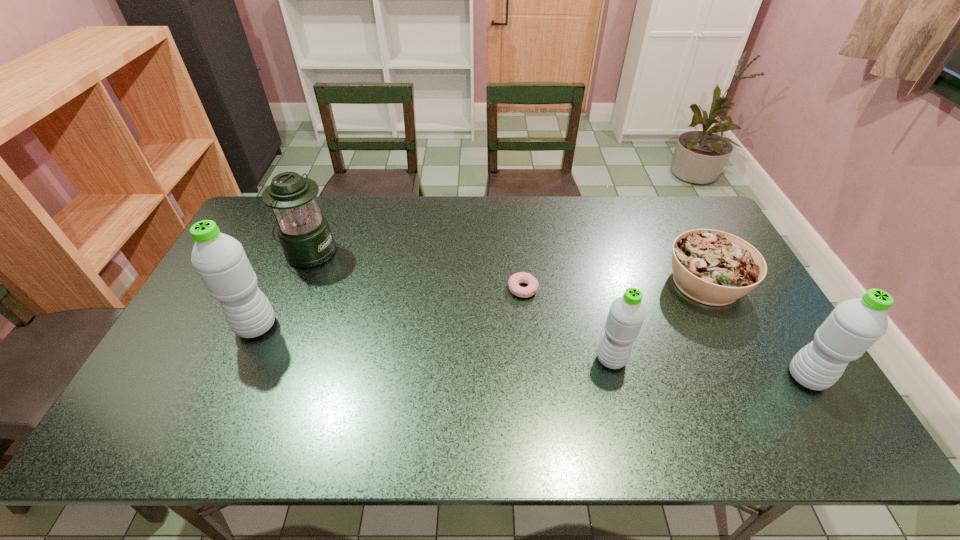
This screenshot has height=540, width=960. I want to click on the leftmost water bottle, so click(x=220, y=260).

You are a GUI agent. You are given a task and a screenshot of the screen. Output one action in this format:
    pyautogui.click(x=<x>, y=<y>)
    Task: Click on the fourth object from left to right
    
    Given the screenshot: What is the action you would take?
    pyautogui.click(x=627, y=313)

Identify the location of the shortest water bottle. Image resolution: width=960 pixels, height=540 pixels. (627, 313).

Where is `the second shortest water bottle`? This screenshot has height=540, width=960. the second shortest water bottle is located at coordinates (854, 325).

At what (x,y) coordinates should I click in order to perform the action: click on lantern. Please return your answer as a coordinate pair (x, y). Looking at the image, I should click on (304, 233).

At what (x,y) coordinates should I click in order to perform the action: click on the fourth object from right to left. Please return your answer as a coordinate pair (x, y). Looking at the image, I should click on (521, 277).

Locate an element on the screen. the shortest object is located at coordinates (521, 277).

Image resolution: width=960 pixels, height=540 pixels. What are the coordinates of `salad` in the screenshot? It's located at (712, 267).

Locate an element on the screen. Image resolution: width=960 pixels, height=540 pixels. free space located on the right of the farthest water bottle is located at coordinates (353, 326).

The width and height of the screenshot is (960, 540). I want to click on vacant region located on the front of the second water bottle from right to left, so click(621, 397).